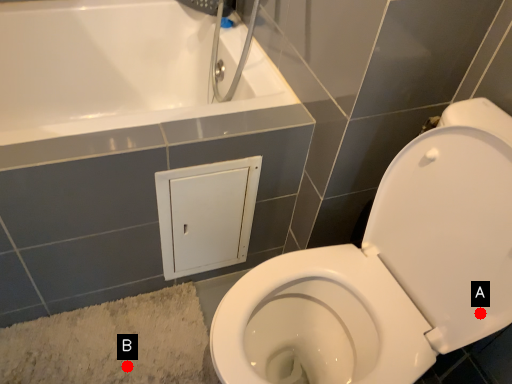
Question: Two points are circled on the image, labeled by A and B beside each circle. Which point is farther from the camera taking this photo?

Choices:
 (A) A is further
 (B) B is further

Answer: (B)